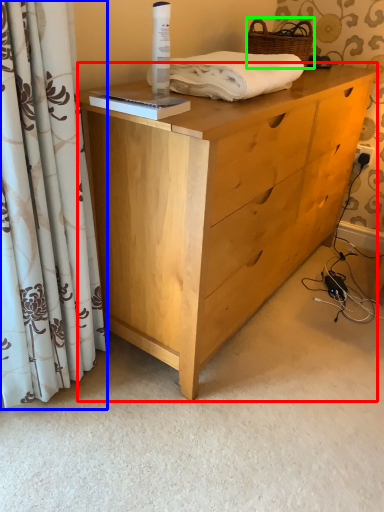
Question: Considering the real-world distances, which object is closest to chest of drawers (highlighted by a red box)? curtain (highlighted by a blue box) or basket (highlighted by a green box).

Choices:
 (A) curtain
 (B) basket

Answer: (A)